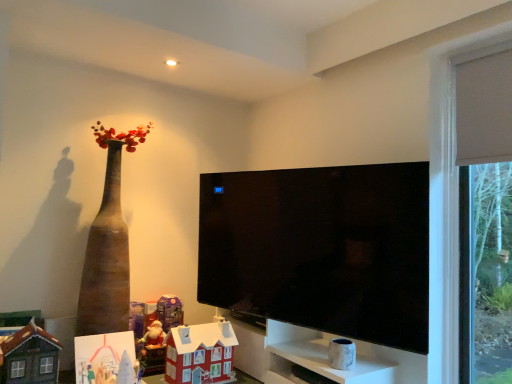
Question: Is point (206, 342) positioned closer to the camera than point (451, 195)?

Choices:
 (A) farther
 (B) closer

Answer: (A)

Question: From a real-world perspective, relative to matte white curtain at right, is cardboard house at center, positioned as the second toy in right-to-left order, vertically above or below?

Choices:
 (A) above
 (B) below

Answer: (B)

Question: Based on their relative distances, which object is nearer to the matte brown house at lower left, the sixth toy in the right-to-left sequence?

Choices:
 (A) matte white paper at lower left, the fifth toy when ordered from right to left
 (B) white marble vase at lower center, which is counted as the 6th toy, starting from the left
 (C) matte plastic santa at lower left, positioned as the 4th toy in right-to-left order
 (D) matte white curtain at right
 (E) white marble cabinet at lower right

Answer: (A)

Question: Estimate the real-world distances between objects in this image. Which object is farther from the matte plastic santa at lower left, positioned as the 4th toy in right-to-left order?

Choices:
 (A) white marble vase at lower center, which is counted as the 6th toy, starting from the left
 (B) matte brown house at lower left, the 1th toy in the left-to-right sequence
 (C) matte white curtain at right
 (D) black glossy tv at center
 (E) matte purple toy at lower center, which is counted as the third toy, starting from the right

Answer: (C)